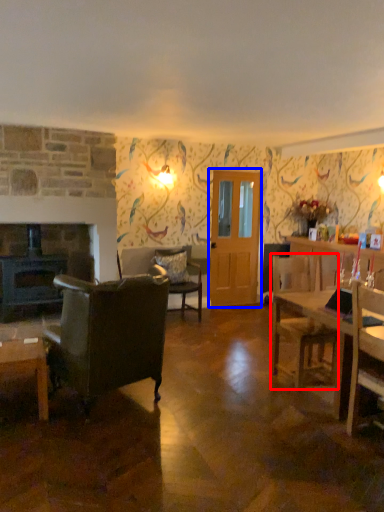
Question: Which object is further to the camera taking this photo, chair (highlighted by a red box) or glass door (highlighted by a blue box)?

Choices:
 (A) chair
 (B) glass door

Answer: (B)